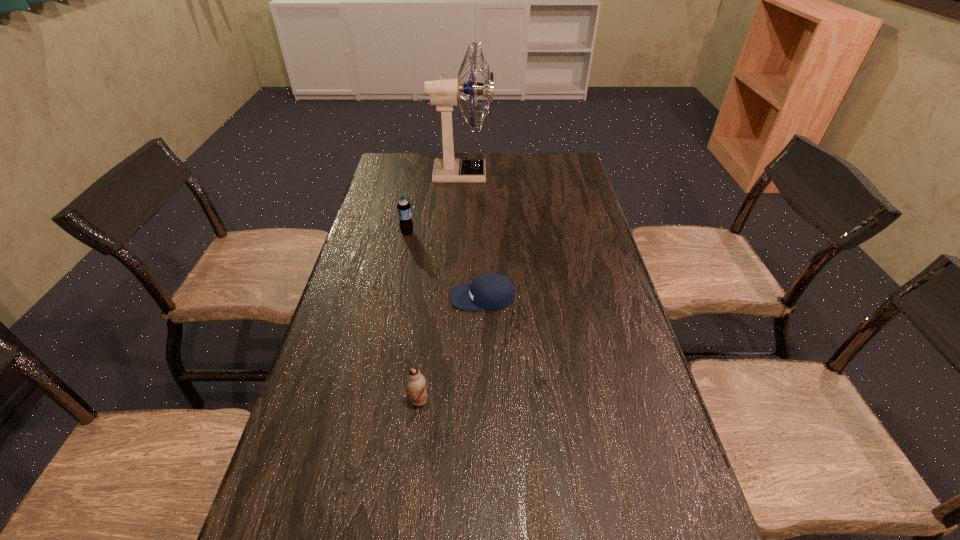
Where is `the farthest object`? the farthest object is located at coordinates (445, 93).

Where is `the tallest object`? the tallest object is located at coordinates (445, 93).

Where is `the third shortest object`? This screenshot has height=540, width=960. the third shortest object is located at coordinates click(x=404, y=208).

This screenshot has width=960, height=540. What are the coordinates of `the leftmost object` in the screenshot? It's located at (404, 208).

Identify the location of the third tallest object. The image size is (960, 540). (416, 383).

Locate an element on the screen. chocolate milk is located at coordinates (416, 383).

Where is `baseball cap`? The height and width of the screenshot is (540, 960). baseball cap is located at coordinates (492, 291).

At what (x,y) coordinates should I click in order to perform the action: click on the shortest object. Please return your answer as a coordinate pair (x, y). Looking at the image, I should click on (492, 291).

I want to click on free space located on the front-facing side of the fan, so click(x=522, y=173).

Find the location of a particular element. This screenshot has height=540, width=960. vacant space located 0.110m on the front of the third shortest object is located at coordinates (402, 259).